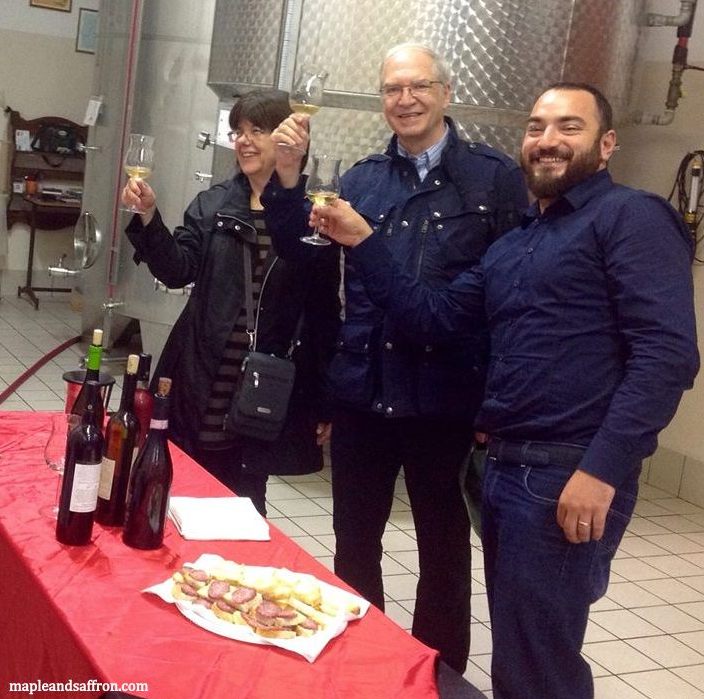
Where is `wine bottle corks`? wine bottle corks is located at coordinates (96, 331), (134, 360), (167, 388).